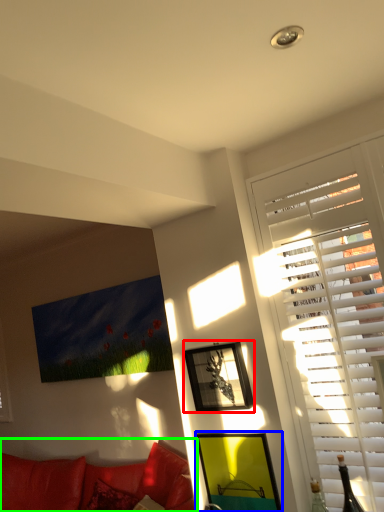
Question: Considering the real-world distances, which object is closest to picture frame (highlighted by a red box)? picture frame (highlighted by a blue box) or studio couch (highlighted by a green box).

Choices:
 (A) picture frame
 (B) studio couch

Answer: (A)